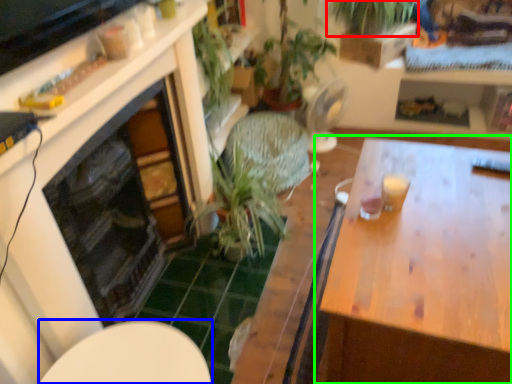
Question: Which object is the closest to the vegetation (highlighted by a red box)? Choose among these: round table (highlighted by a blue box) or table (highlighted by a green box).

Choices:
 (A) round table
 (B) table

Answer: (B)